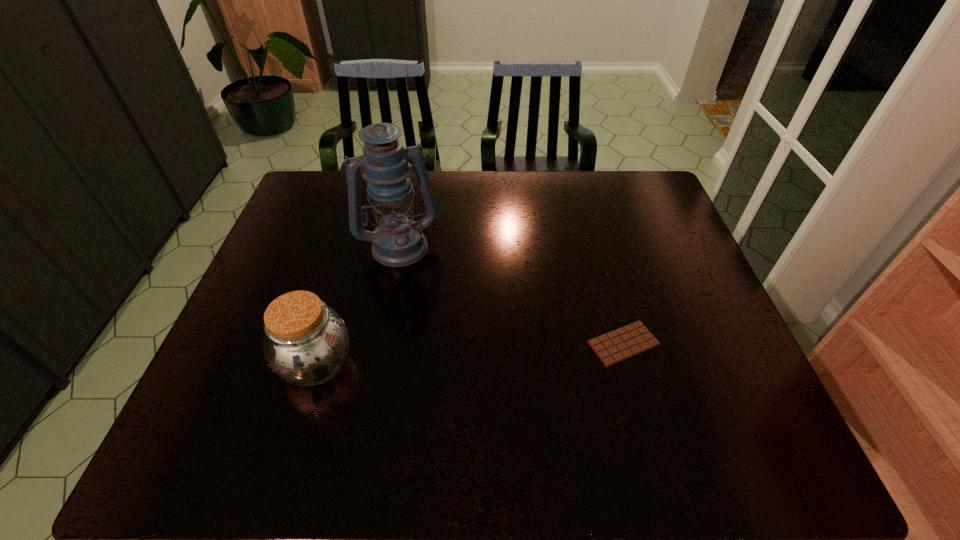
Identify the location of object that is positioned at the near edge. (306, 343).

Locate an element on the screen. object located at the left edge is located at coordinates (306, 343).

Locate an element on the screen. The width and height of the screenshot is (960, 540). object at the near left corner is located at coordinates (306, 343).

In the image, there is a desktop. At what (x,y) coordinates should I click in order to perform the action: click on vacant region at the far edge. Please return your answer as a coordinate pair (x, y). This screenshot has width=960, height=540. Looking at the image, I should click on (467, 172).

Find the location of a particular element. free space at the near edge of the desktop is located at coordinates (484, 414).

You are a GUI agent. You are given a task and a screenshot of the screen. Output one action in this format:
    pyautogui.click(x=<x>, y=<y>)
    Task: Click on the blank area at the left edge
    This screenshot has width=960, height=540.
    Given the screenshot: What is the action you would take?
    pyautogui.click(x=278, y=239)

You are a GUI agent. You are given a task and a screenshot of the screen. Output one action in this format:
    pyautogui.click(x=<x>, y=<y>)
    Task: Click on the vacant region at the right edge
    
    Given the screenshot: What is the action you would take?
    pyautogui.click(x=703, y=332)

In order to click on vacant space at the far left corner of the desktop in this screenshot , I will do `click(311, 191)`.

Identify the location of free space at the far right corner of the desktop. The width and height of the screenshot is (960, 540). (618, 189).

At what (x,y) coordinates should I click in order to perform the action: click on free location at the near right corner of the desktop. Please return your answer as a coordinate pair (x, y). Looking at the image, I should click on click(768, 415).